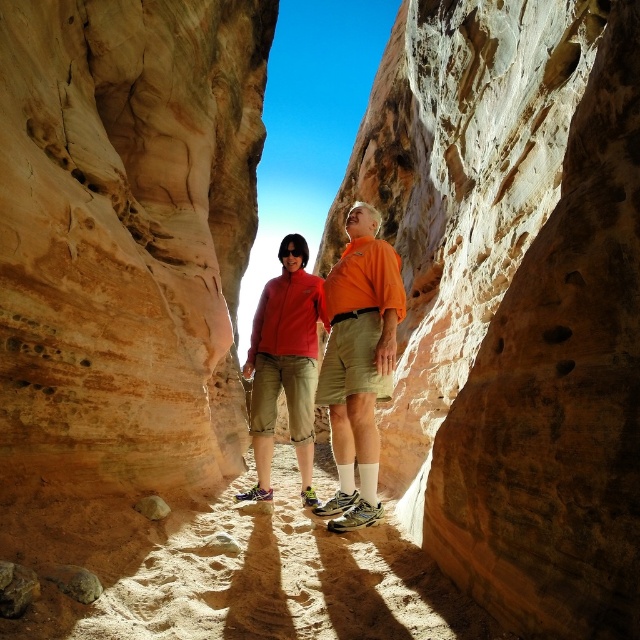
You are a photographer planning to take a photo of the matte orange shirt at center and the smooth brown rock at lower left. Which object should you focus on first if you want to capture both in sharp focus, considering their sizes?

The matte orange shirt at center is larger in size compared to the smooth brown rock at lower left, so you should focus on the matte orange shirt at center first to ensure both are in sharp focus.

You are a photographer planning to take a photo of the matte orange shirt at center in the slot canyon. To ensure the shirt is well lit, where should you position the camera relative to the sunlight coming from above? Please provide coordinates in the format of x,y where x is the horizontal axis from 0 to 1 and y is the vertical axis from 0 to 1.

The matte orange shirt at center is located at point (358, 362). To ensure proper lighting, position the camera so that the sunlight from above directly illuminates the shirt. Since the shirt is at the center, align the camera slightly below it at coordinates approximately (256, 362) to capture the sunlight effectively.

You are standing in the narrow slot canyon and want to place a small backpack between the smooth brown rock at lower left and the smooth brown rock at lower center. Which rock should you place it next to if you want the backpack to be closer to the left wall of the canyon?

You should place the backpack next to the smooth brown rock at lower left because it is positioned on the left side of the smooth brown rock at lower center, making it closer to the left wall of the canyon.